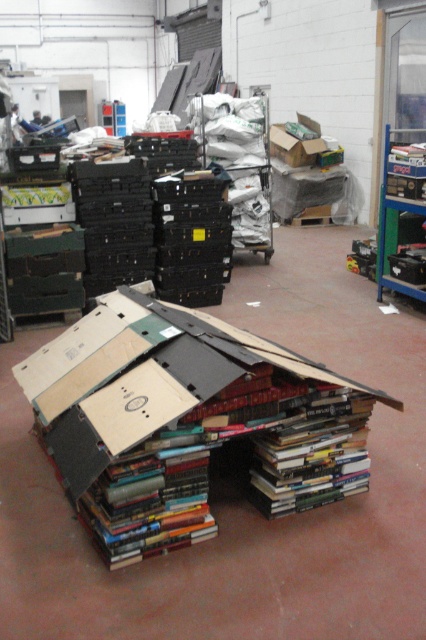
Question: Is metallic blue bookshelf at upper right smaller than cardboard box at upper center?

Choices:
 (A) yes
 (B) no

Answer: (A)

Question: Can you confirm if metallic blue bookshelf at upper right is positioned to the right of cardboard box at upper center?

Choices:
 (A) yes
 (B) no

Answer: (A)

Question: Among these points, which one is nearest to the camera?

Choices:
 (A) (287, 150)
 (B) (397, 202)

Answer: (B)

Question: Is metallic blue bookshelf at upper right to the right of cardboard box at upper center from the viewer's perspective?

Choices:
 (A) no
 (B) yes

Answer: (B)